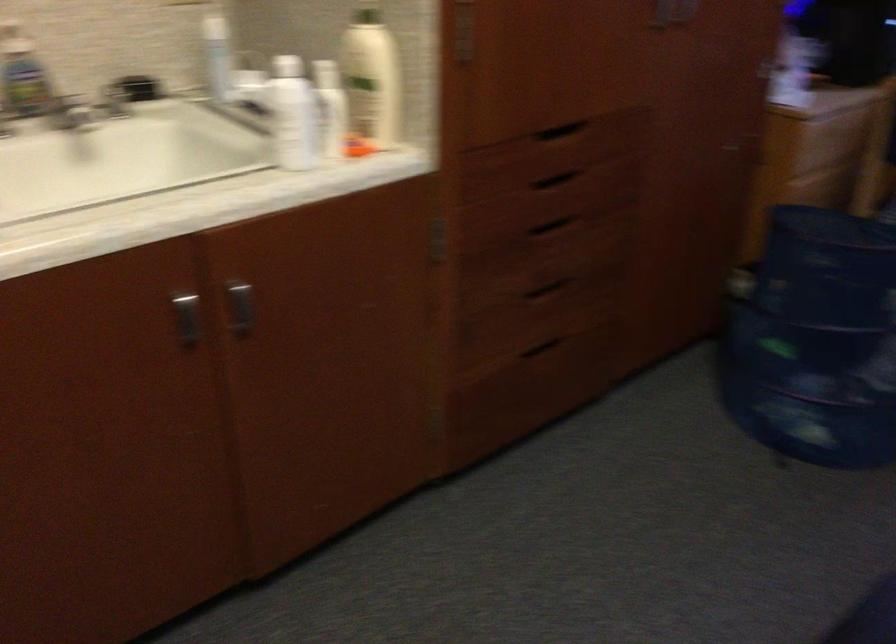
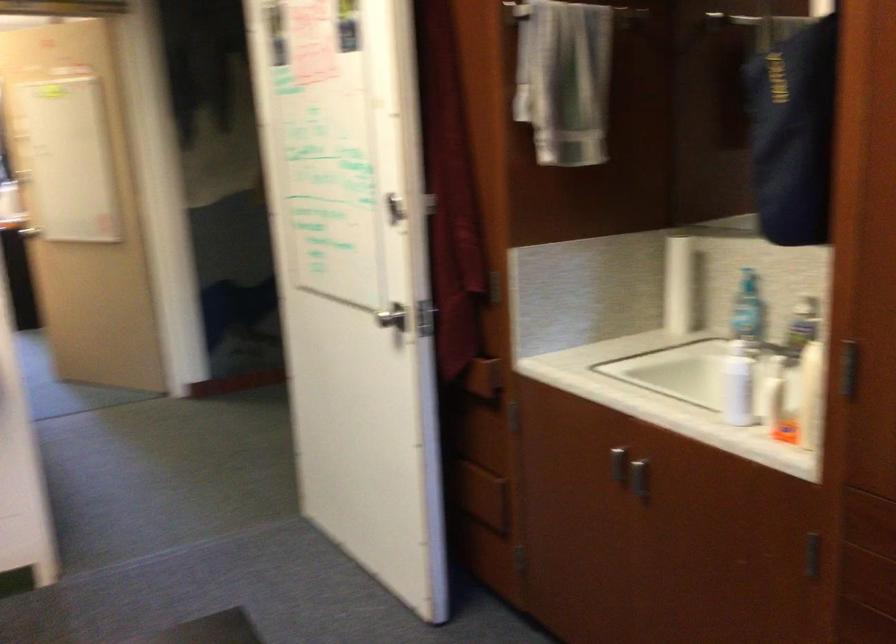
Where in the second image is the point corresponding to (162,327) from the first image?

(618, 464)